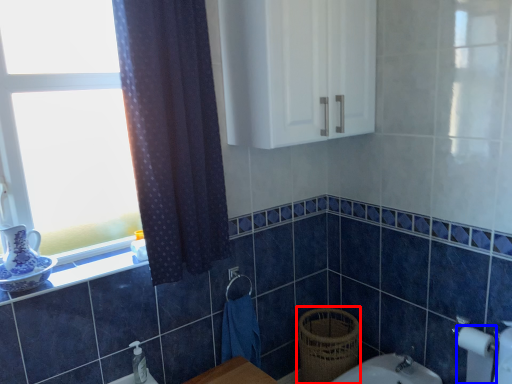
Question: Which point is closer to the camera, basket (highlighted by a red box) or toilet paper (highlighted by a blue box)?

Choices:
 (A) basket
 (B) toilet paper

Answer: (B)